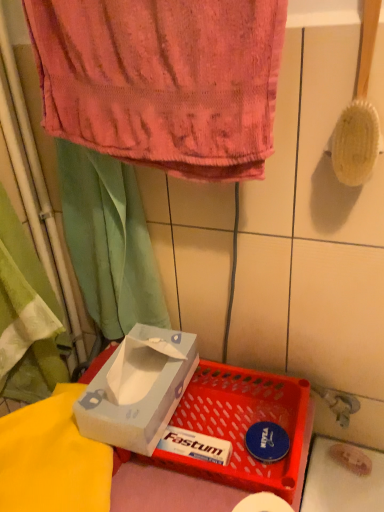
Where is `free space above translucent plastic tray at lower center (from a real-world perspective)`? This screenshot has width=384, height=512. free space above translucent plastic tray at lower center (from a real-world perspective) is located at coordinates (215, 436).